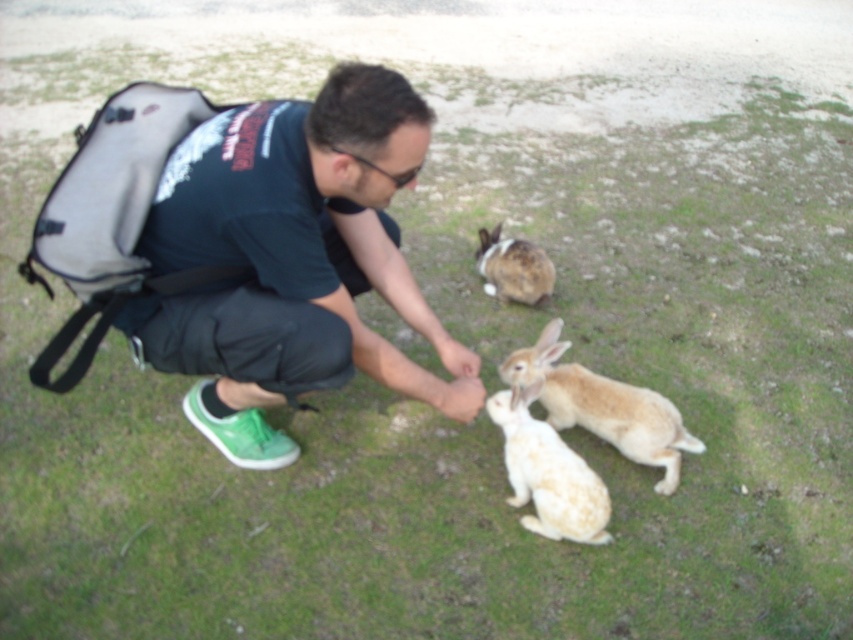
Between point (676, 452) and point (518, 422), which one is positioned behind?

Point (676, 452)

Measure the distance between light brown fur rabbit at center and white fluffy rabbit at lower center.

12.22 inches

Between point (651, 404) and point (540, 428), which one is positioned behind?

Positioned behind is point (651, 404).

Image resolution: width=853 pixels, height=640 pixels. Find the location of `light brown fur rabbit at center`. light brown fur rabbit at center is located at coordinates (602, 404).

Can you confirm if green fabric shirt at center is positioned to the left of brown speckled fur at center?

Correct, you'll find green fabric shirt at center to the left of brown speckled fur at center.

Is green fabric shirt at center smaller than brown speckled fur at center?

Actually, green fabric shirt at center might be larger than brown speckled fur at center.

Does point (250, 444) lie behind point (550, 294)?

No, it is in front of (550, 294).

Find the location of `green fabric shirt at center`. green fabric shirt at center is located at coordinates (292, 259).

Can you confirm if green fabric shirt at center is wider than white fluffy rabbit at lower center?

Yes, green fabric shirt at center is wider than white fluffy rabbit at lower center.

Where is `green fabric shirt at center`? This screenshot has height=640, width=853. green fabric shirt at center is located at coordinates (292, 259).

Find the location of a particular element. The height and width of the screenshot is (640, 853). green fabric shirt at center is located at coordinates (292, 259).